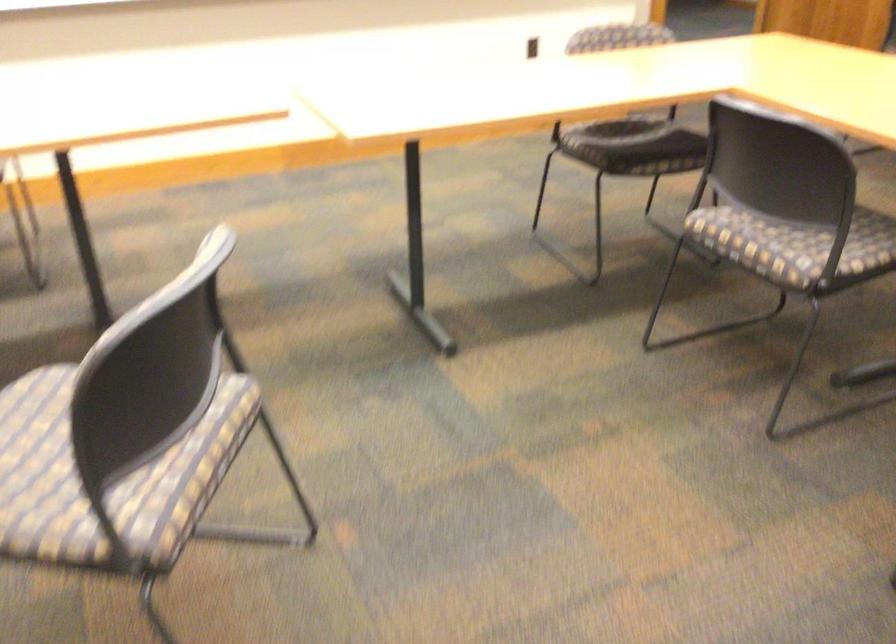
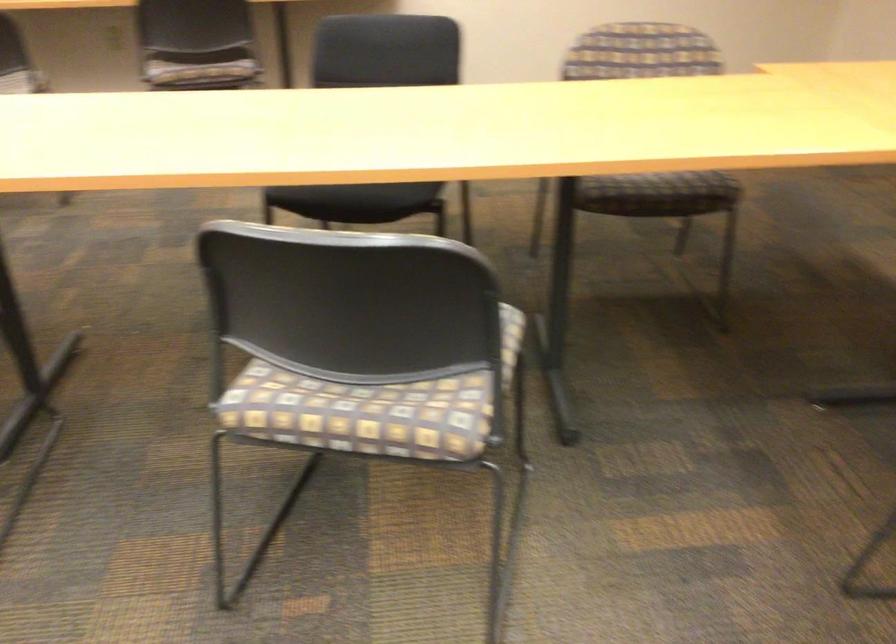
How did the camera likely rotate?

The camera rotated toward right-down.